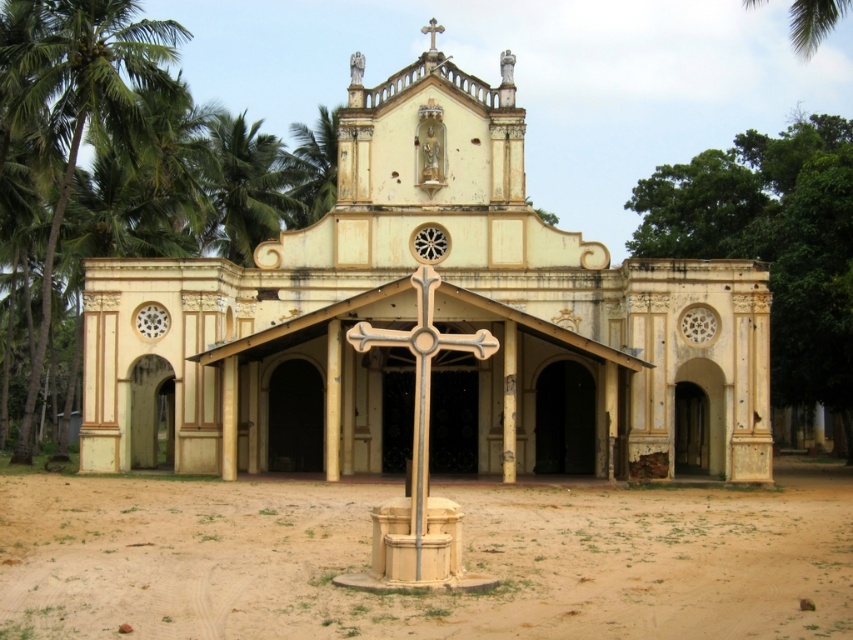
Question: Among these points, which one is farthest from the camera?

Choices:
 (A) (431, 285)
 (B) (579, 468)
 (C) (103, 36)

Answer: (C)

Question: Does green leafy palm tree at left have a lesser width compared to green leafy palm tree at upper left?

Choices:
 (A) no
 (B) yes

Answer: (A)

Question: Which of the following is the closest to the observer?

Choices:
 (A) green leafy palm tree at left
 (B) green leafy palm tree at upper center

Answer: (A)

Question: Among these objects, which one is nearest to the camera?

Choices:
 (A) white stone cross at upper center
 (B) green leafy palm tree at upper center
 (C) green leafy palm tree at upper left

Answer: (A)

Question: Is white stone cross at center bigger than green leafy palm tree at upper left?

Choices:
 (A) yes
 (B) no

Answer: (A)

Question: Can you confirm if green leafy palm tree at left is thinner than green leafy palm tree at upper left?

Choices:
 (A) yes
 (B) no

Answer: (B)